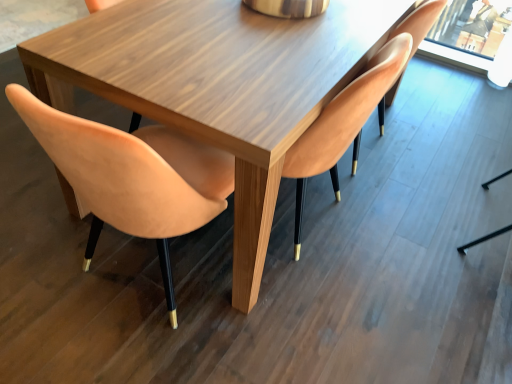
Question: From the image's perspective, is matte wood chair at center, the 2th chair positioned from the left, located above or below matte orange chair at upper right, arranged as the 1th chair when viewed from the right?

Choices:
 (A) above
 (B) below

Answer: (B)

Question: Looking at their shapes, would you say matte wood chair at center, the 2th chair positioned from the left, is wider or thinner than matte orange chair at upper right, the 3th chair in the left-to-right sequence?

Choices:
 (A) wide
 (B) thin

Answer: (A)

Question: Based on their relative distances, which object is farther from the suede-like peach chair at left, which is counted as the first chair, starting from the left?

Choices:
 (A) matte wood chair at center, the 2th chair positioned from the left
 (B) matte orange chair at upper right, arranged as the 1th chair when viewed from the right

Answer: (B)

Question: Which object is the closest to the matte wood chair at center, which is the 2th chair from right to left?

Choices:
 (A) suede-like peach chair at left, which is counted as the first chair, starting from the left
 (B) matte orange chair at upper right, arranged as the 1th chair when viewed from the right

Answer: (B)